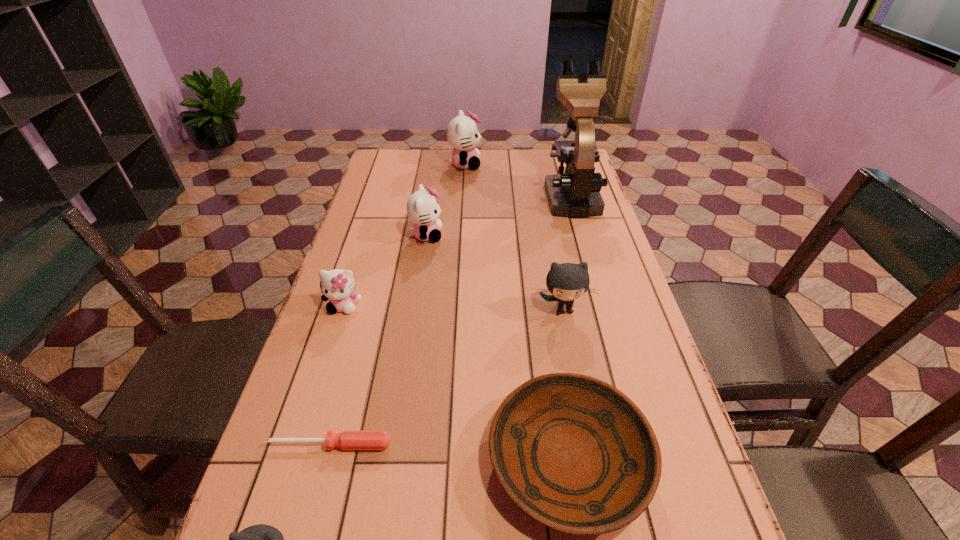
This screenshot has height=540, width=960. I want to click on free area in between the bigger gray kitten and the fourth nearest kitten, so click(x=494, y=272).

Where is `unoccupied area between the shortest object and the nearest white kitten`? unoccupied area between the shortest object and the nearest white kitten is located at coordinates coord(337,375).

The height and width of the screenshot is (540, 960). What are the coordinates of `vacant area between the microscope and the screwdriver` in the screenshot? It's located at (451, 320).

Identify the location of blank region between the smallest white kitten and the right gray kitten. (453, 308).

You are a GUI agent. You are given a task and a screenshot of the screen. Output one action in this format:
    pyautogui.click(x=<x>, y=<y>)
    Task: Click on the vacant space that is in between the third farthest object and the farthest white kitten
    
    Given the screenshot: What is the action you would take?
    pyautogui.click(x=445, y=200)

I want to click on free area in between the smallest white kitten and the farther gray kitten, so click(x=453, y=308).

Locate which object is the fourth closest to the tallest object. Please provide its 2D coordinates. Your answer should be formatted as a tuple, i.e. [(x, y)], where the tuple contains the x and y coordinates of a point satisfying the conditions above.

[(337, 285)]

Locate an element on the screen. The image size is (960, 540). the closest object to the brown plate is located at coordinates (349, 439).

This screenshot has width=960, height=540. What are the coordinates of `kitten that is the third closest to the rightmost kitten` in the screenshot? It's located at (261, 539).

Identify which kitten is the closest to the microscope. Please provide its 2D coordinates. Your answer should be formatted as a tuple, i.e. [(x, y)], where the tuple contains the x and y coordinates of a point satisfying the conditions above.

[(462, 133)]